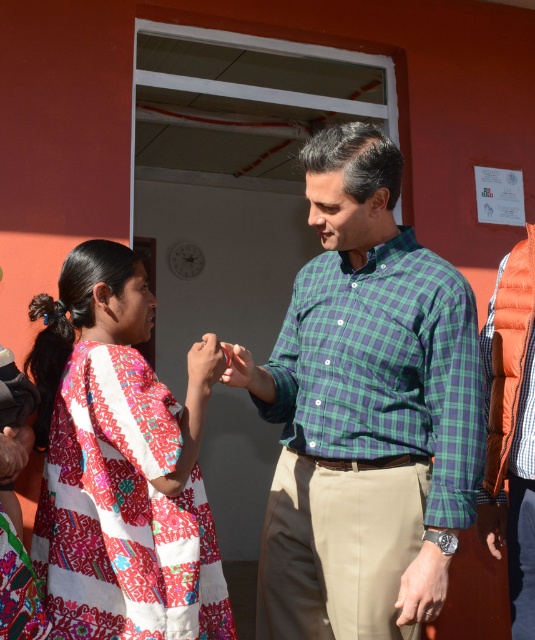
From the picture: Please describe the location of the embroidered cotton dress at center in the image using coordinates.

The embroidered cotton dress at center is located at coordinates point (118, 467).

You are a photographer standing at the point marked by the coordinate point at point (103, 544). You want to take a photo of the young girl in the colorful traditional outfit and the adult male in the green and purple checkered shirt. Based on their current positions, will you be able to capture both of them in the same frame without moving your camera? Explain your reasoning.

The young girl and the adult male are 6.44 feet apart. Since the photographer is positioned at point (103, 544), which is likely between them or at a vantage point that allows capturing both within the camera frame, it is possible to include both in the same photo without moving the camera. Their distance apart does not exceed typical camera frame coverage.

You are a photographer trying to capture a candid shot of the scene. You notice the green plaid shirt at center and the smooth skin hand at center. Which object is positioned lower in the image?

The green plaid shirt at center is located below the smooth skin hand at center, so the green plaid shirt at center is positioned lower in the image.